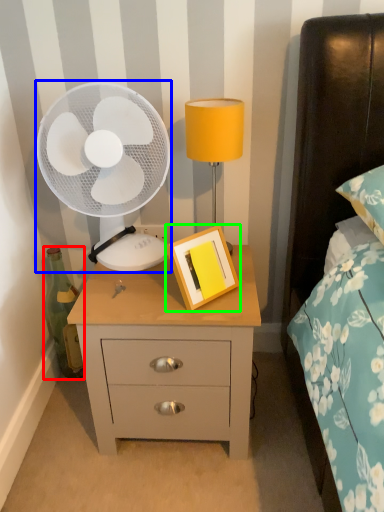
Question: Based on their relative distances, which object is nearer to bottle (highlighted by a red box)? Choose from mechanical fan (highlighted by a blue box) and picture frame (highlighted by a green box).

Choices:
 (A) mechanical fan
 (B) picture frame

Answer: (A)